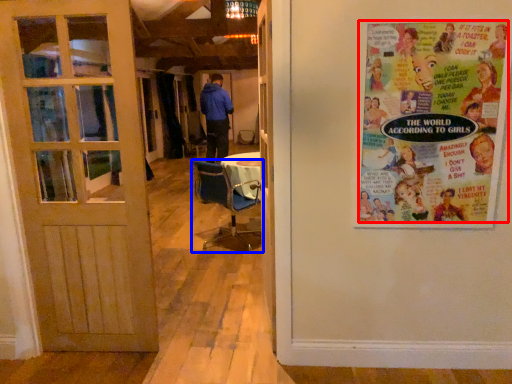
Question: Which object appears farthest to the camera in this image, poster (highlighted by a red box) or chair (highlighted by a blue box)?

Choices:
 (A) poster
 (B) chair

Answer: (B)